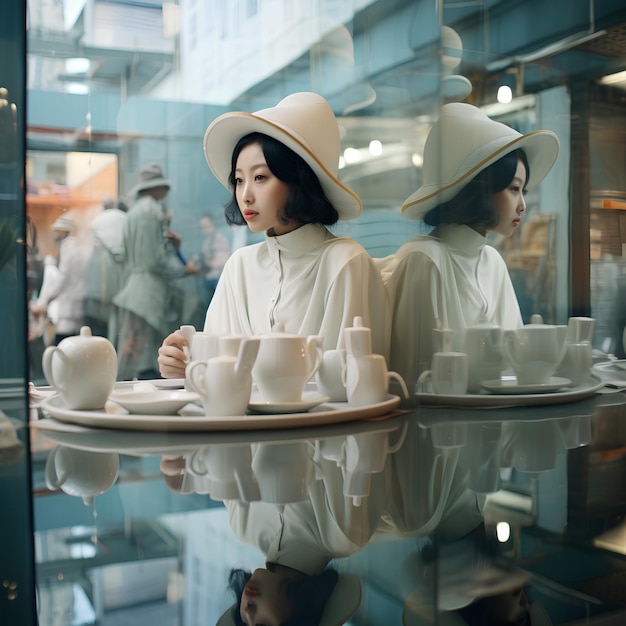
The height and width of the screenshot is (626, 626). Find the location of `tray`. tray is located at coordinates (168, 419), (483, 399).